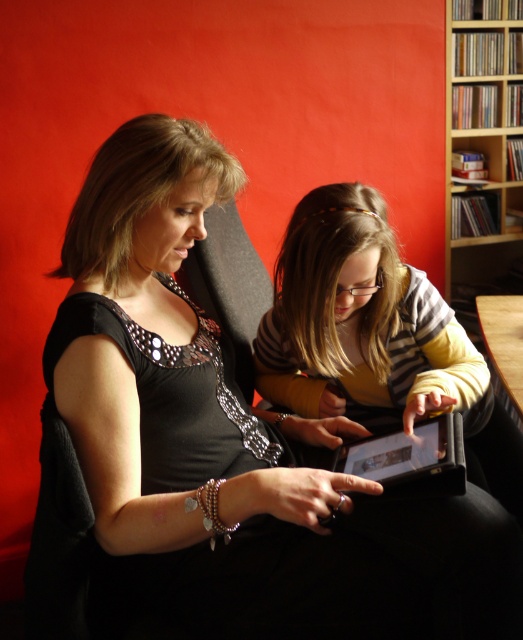
This screenshot has width=523, height=640. Describe the element at coordinates (374, 337) in the screenshot. I see `matte black tablet at center` at that location.

Can you confirm if matte black tablet at center is wider than wooden bookshelf at upper right?

Indeed, matte black tablet at center has a greater width compared to wooden bookshelf at upper right.

Where is `matte black tablet at center`? matte black tablet at center is located at coordinates (374, 337).